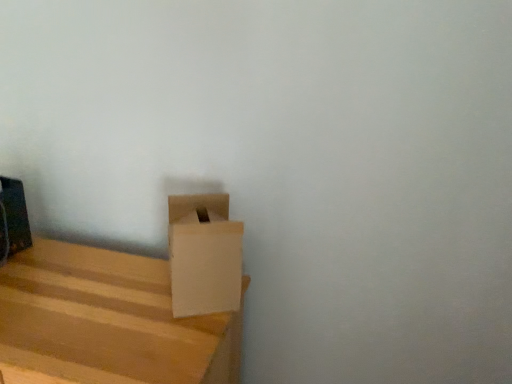
This screenshot has height=384, width=512. Identify the location of free point in front of white cardboard box at lower left. (167, 339).